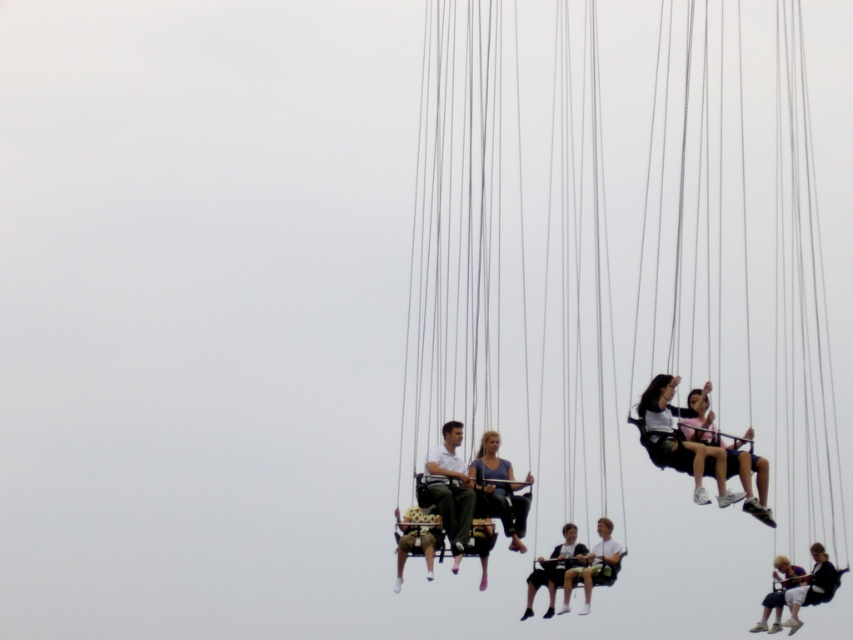
Find the location of a particular element. light pink fabric swing at center is located at coordinates (733, 461).

Consider the image. Between light pink fabric swing at center and dark blue jeans at center, which one appears on the left side from the viewer's perspective?

Positioned to the left is dark blue jeans at center.

Find the location of a particular element. Image resolution: width=853 pixels, height=640 pixels. light pink fabric swing at center is located at coordinates (733, 461).

The height and width of the screenshot is (640, 853). Describe the element at coordinates (500, 486) in the screenshot. I see `blue fabric swing at center` at that location.

Who is more forward, [506,522] or [554,554]?

Positioned in front is point [506,522].

Identify the location of blue fabric swing at center. The image size is (853, 640). (500, 486).

Does matte black swing at upper right have a larger size compared to light brown wooden swing at center?

Indeed, matte black swing at upper right has a larger size compared to light brown wooden swing at center.

Between matte black swing at upper right and light brown wooden swing at center, which one appears on the right side from the viewer's perspective?

From the viewer's perspective, light brown wooden swing at center appears more on the right side.

The image size is (853, 640). What do you see at coordinates (680, 438) in the screenshot?
I see `matte black swing at upper right` at bounding box center [680, 438].

This screenshot has width=853, height=640. Identify the location of matte black swing at upper right. (680, 438).